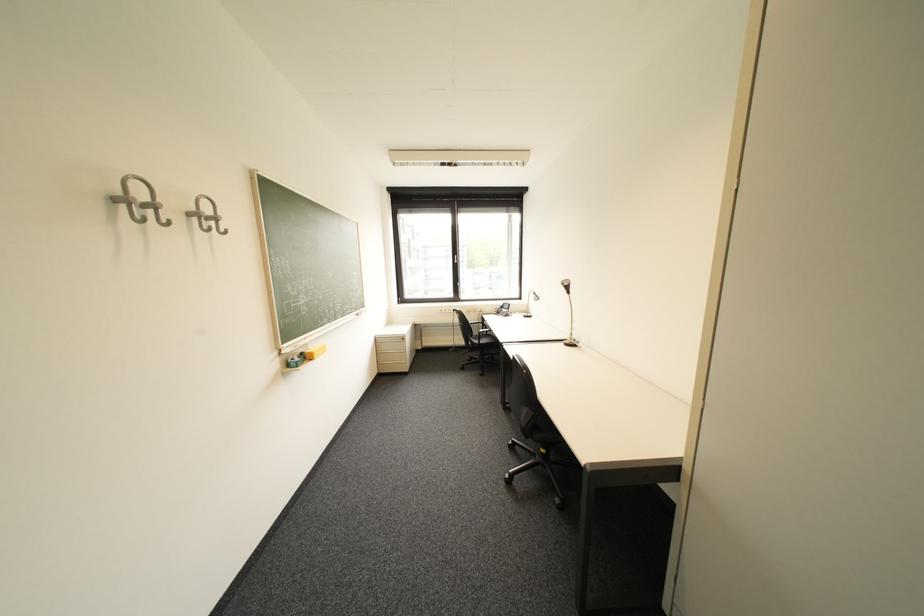
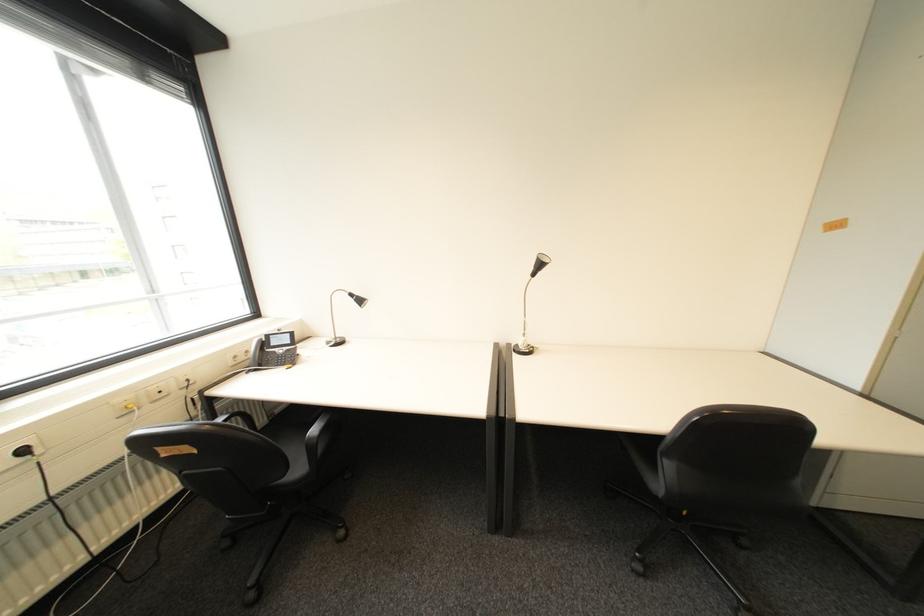
Where in the second image is the point corresponding to point (465, 310) from the first image?

(34, 452)